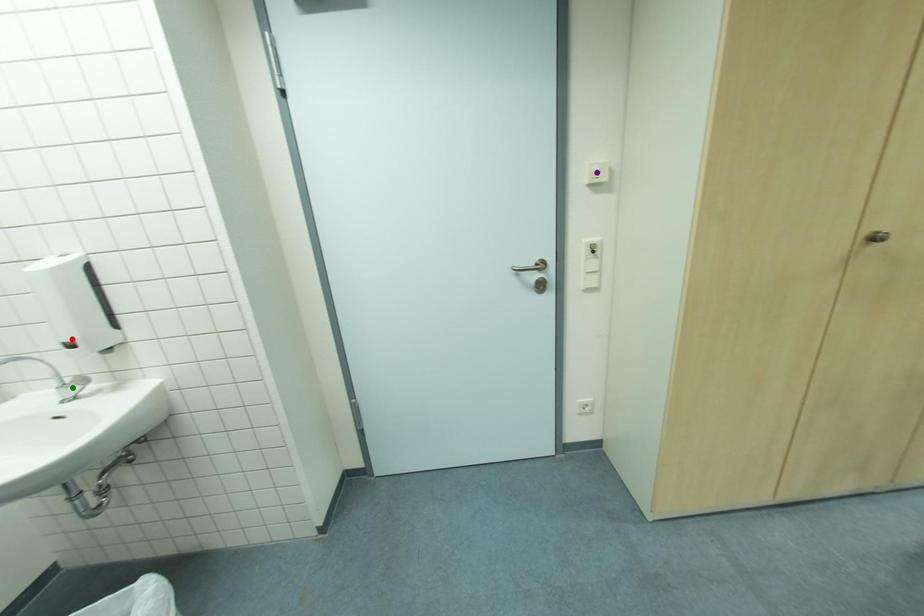
Order these from nearest to farthest:
purple point | red point | green point

red point, green point, purple point